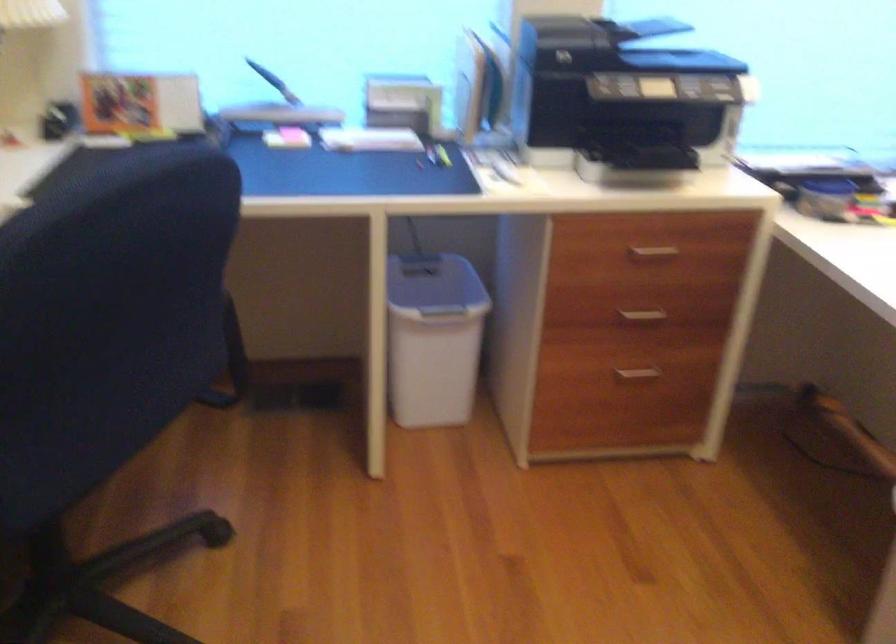
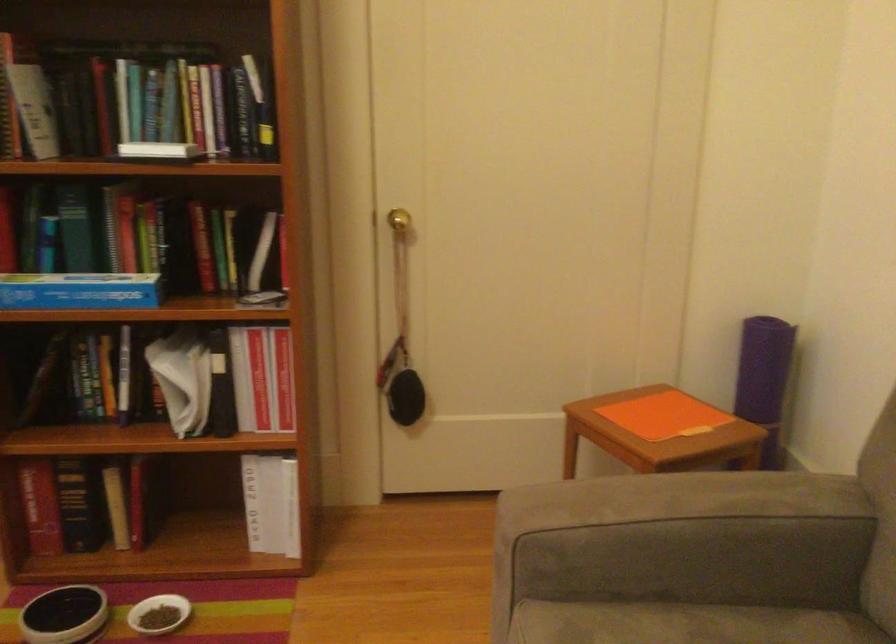
How did the camera likely rotate?

The camera's rotation is toward right-down.